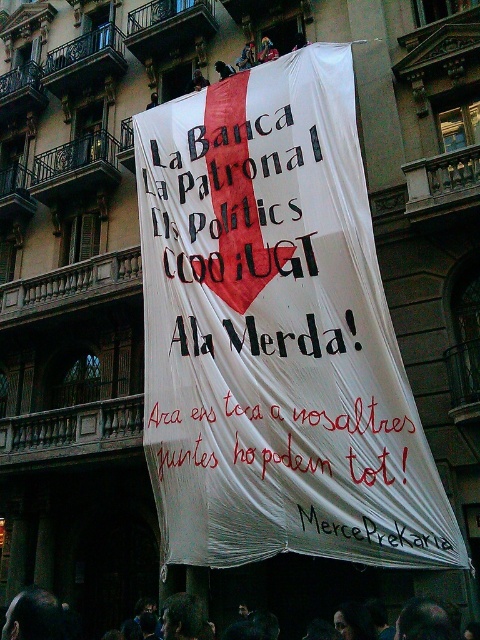
Is white fabric banner at center in front of dark hair at lower center?

That is False.

Based on the photo, can you confirm if white fabric banner at center is smaller than dark hair at lower center?

Actually, white fabric banner at center might be larger than dark hair at lower center.

Between point (358, 264) and point (192, 632), which one is positioned in front?

Point (192, 632)

The height and width of the screenshot is (640, 480). Identify the location of white fabric banner at center. (273, 326).

Which is more to the right, red fabric banner at center or dark hair at lower center?

From the viewer's perspective, red fabric banner at center appears more on the right side.

Can you confirm if red fabric banner at center is positioned below dark hair at lower center?

Incorrect, red fabric banner at center is not positioned below dark hair at lower center.

Who is more forward, (388,444) or (430,625)?

Point (430,625) is in front.

What are the coordinates of `red fabric banner at center` in the screenshot? It's located at (290, 438).

Does point (56, 632) lie behind point (377, 536)?

That is False.

Consider the image. Is dark hair at lower center thinner than black paper at center?

In fact, dark hair at lower center might be wider than black paper at center.

Is point (59, 637) positioned after point (414, 545)?

No, (59, 637) is closer to viewer.

Where is `dark hair at lower center`? dark hair at lower center is located at coordinates (35, 616).